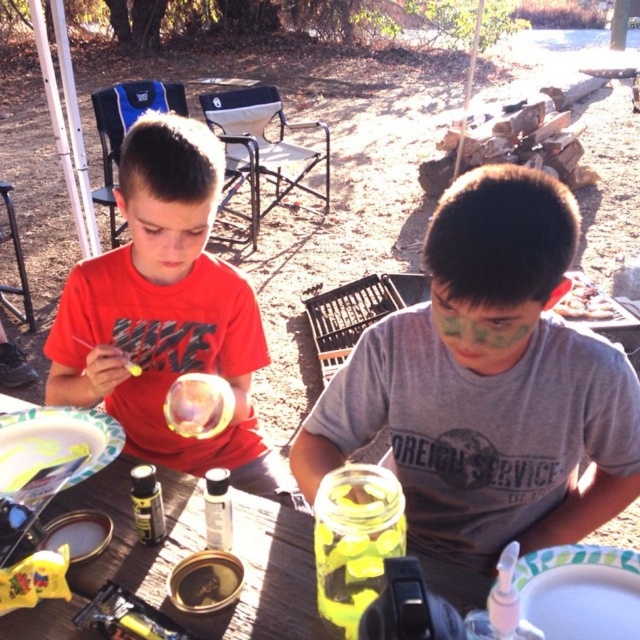
Question: Does matte gray shirt at center have a lesser width compared to wooden table at center?

Choices:
 (A) yes
 (B) no

Answer: (B)

Question: Which object is farther from the camera taking this photo?

Choices:
 (A) matte red shirt at center
 (B) green matte face paint at center
 (C) green matte paint at upper center
 (D) white paper plate at lower right

Answer: (C)

Question: Which of the following is the farthest from the observer?

Choices:
 (A) wooden table at center
 (B) matte gray shirt at center

Answer: (A)

Question: Is matte gray shirt at center further to camera compared to matte red shirt at left?

Choices:
 (A) no
 (B) yes

Answer: (A)

Question: Does matte red shirt at left lie behind white paper plate at lower right?

Choices:
 (A) no
 (B) yes

Answer: (B)

Question: Among these objects, which one is farthest from the camera?

Choices:
 (A) white paper plate at lower right
 (B) matte gray shirt at center

Answer: (B)